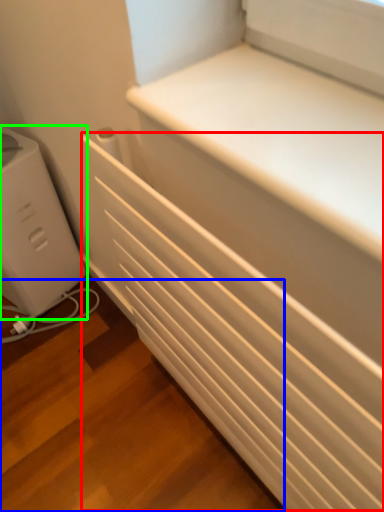
Question: Based on their relative distances, which object is farther from radiator (highlighted by a red box)? Choose from stairwell (highlighted by a blue box) and home appliance (highlighted by a green box).

Choices:
 (A) stairwell
 (B) home appliance

Answer: (B)